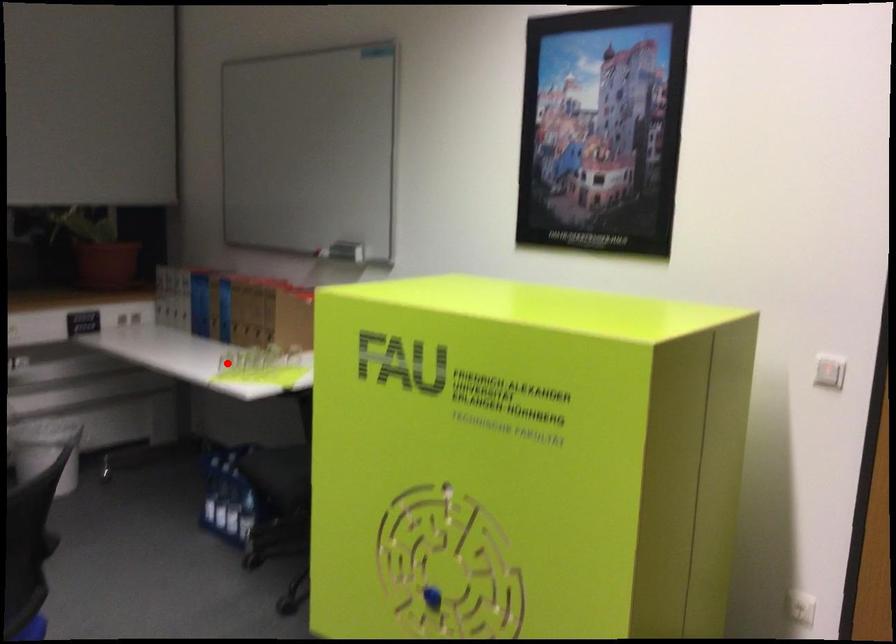
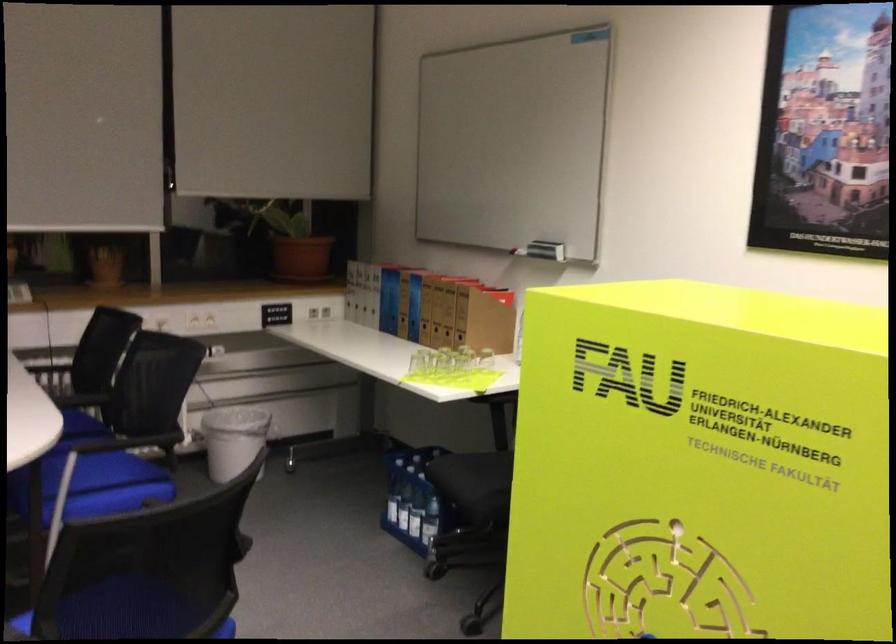
Question: I am providing you with two images of the same scene from different viewpoints. A red point is marked on the first image. At the location where the point appears in image 1, is it still visible in image 2?

Choices:
 (A) Yes
 (B) No

Answer: (A)